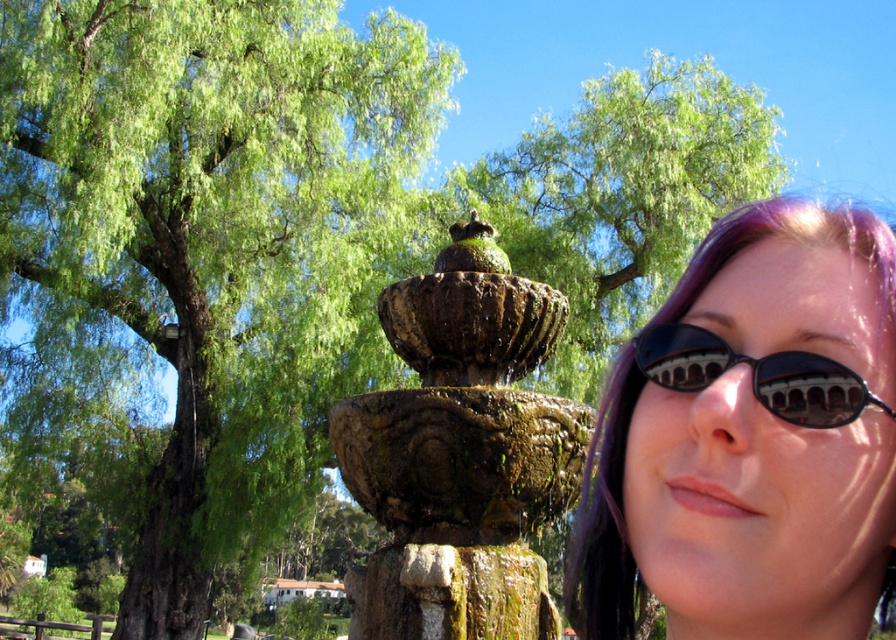
You are a photographer trying to capture a photo where both the purple hair at center and the green leafy tree at center are visible. Based on their heights, which object should you focus on first to ensure both are in frame?

The purple hair at center has a lesser height compared to green leafy tree at center, so you should focus on the green leafy tree at center first to ensure both are in frame.